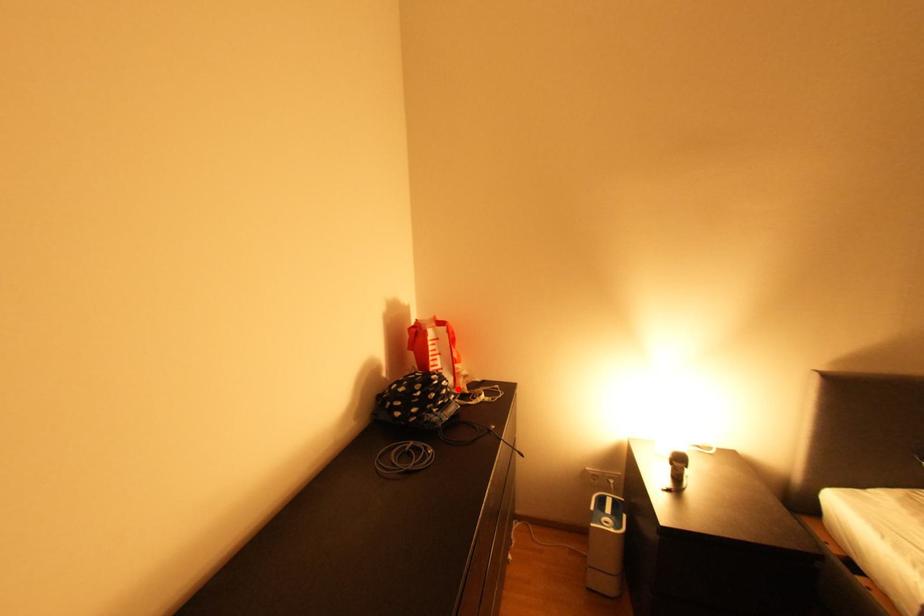
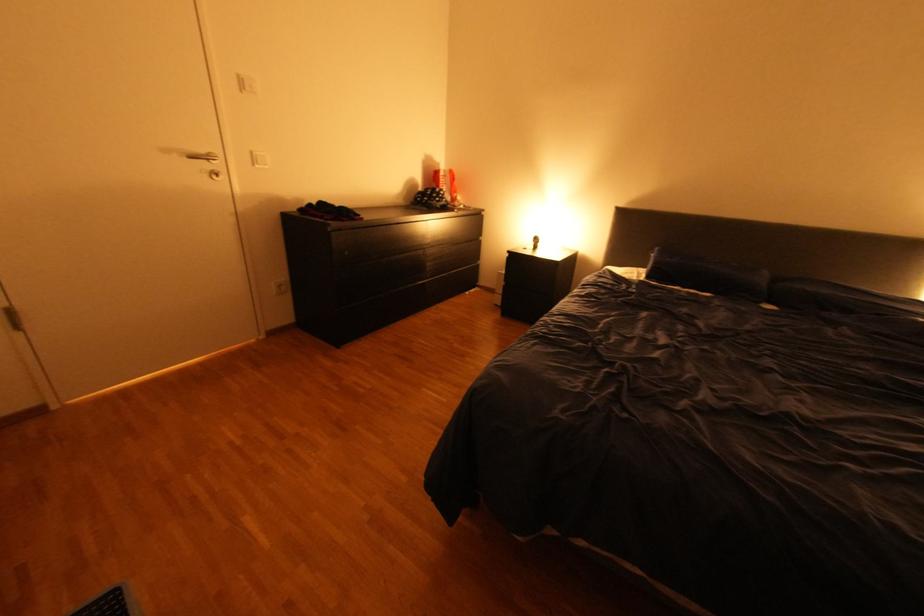
Locate, in the second image, the point that corresponds to the highlighted location in the first image.

(454, 196)